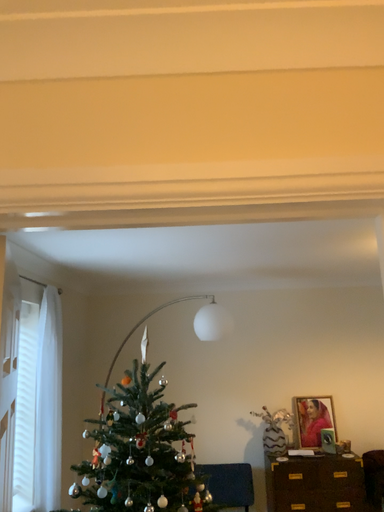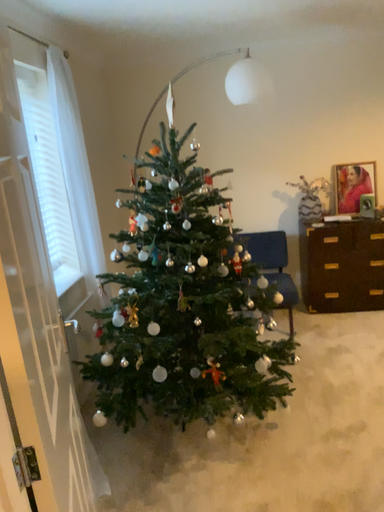
Question: Which way did the camera rotate in the video?

Choices:
 (A) rotated downward
 (B) rotated upward

Answer: (A)